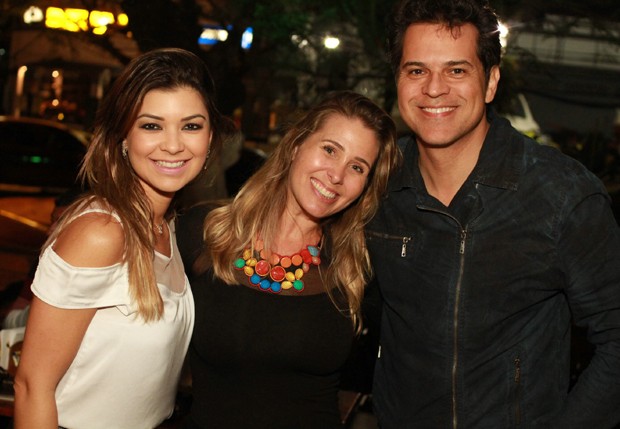
Identify the location of yellow light. (54, 18), (73, 16), (103, 16), (121, 18).